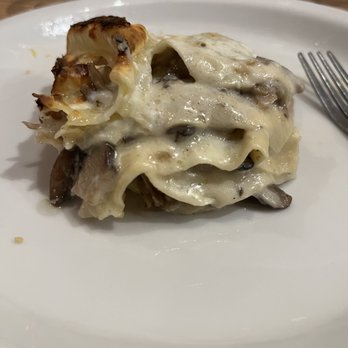
Locate an element on the screen. foam is located at coordinates (171, 103).